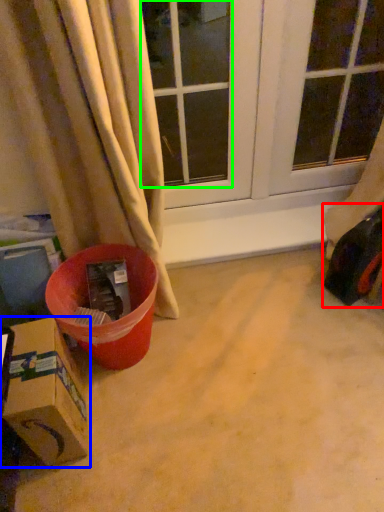
Question: Estimate the real-world distances between objects in this image. Which object is closer to toy car (highlighted by a red box), box (highlighted by a blue box) or window (highlighted by a green box)?

Choices:
 (A) box
 (B) window

Answer: (A)